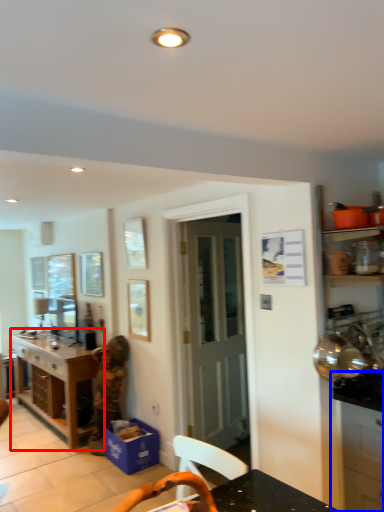
Question: Among these objects, which one is nearest to the camera, table (highlighted by a red box) or cabinetry (highlighted by a blue box)?

Choices:
 (A) table
 (B) cabinetry

Answer: (B)